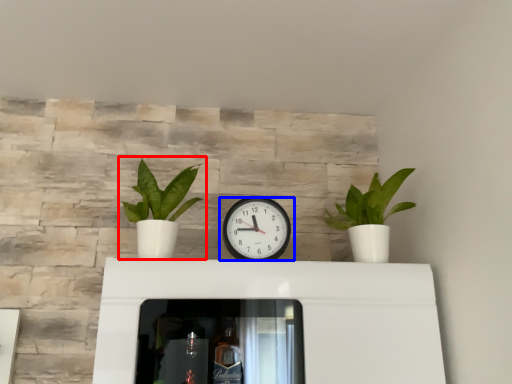
Question: Which object is further to the camera taking this photo, houseplant (highlighted by a red box) or wall clock (highlighted by a blue box)?

Choices:
 (A) houseplant
 (B) wall clock

Answer: (B)